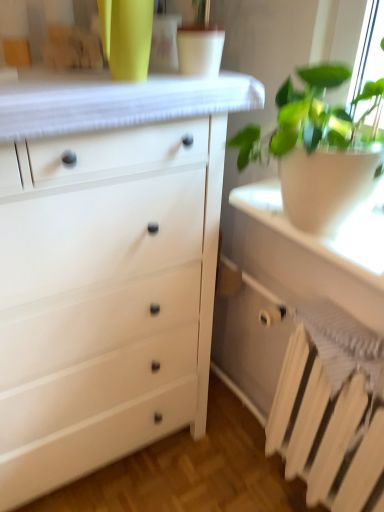
This screenshot has width=384, height=512. What do you see at coordinates (318, 150) in the screenshot?
I see `white matte pot at right` at bounding box center [318, 150].

The height and width of the screenshot is (512, 384). What do you see at coordinates (289, 284) in the screenshot? I see `white matte radiator at lower right` at bounding box center [289, 284].

At what (x,y) coordinates should I click in order to perform the action: click on white textured fabric at upper center. Please return your answer as a coordinate pair (x, y). Looking at the image, I should click on (118, 102).

Is point (260, 364) closer or farther from the camera than point (162, 83)?

Point (260, 364).

How different are the orientations of white matte radiator at lower right and white textured fabric at upper center in degrees?

white matte radiator at lower right and white textured fabric at upper center are facing 88.1 degrees away from each other.

Is white matte radiator at lower right in contact with white textured fabric at upper center?

There is a gap between white matte radiator at lower right and white textured fabric at upper center.

How far apart are white matte radiator at lower right and white textured fabric at upper center?

22.80 inches.

The image size is (384, 512). In order to click on chest of drawers above the white matte radiator at lower right (from a real-world perspective) in this screenshot , I will do `click(107, 270)`.

Is the depth of white matte chest of drawers at left less than that of white matte radiator at lower right?

Yes, white matte chest of drawers at left is closer to the camera.

Can you confirm if white matte chest of drawers at left is thinner than white matte radiator at lower right?

No, white matte chest of drawers at left is not thinner than white matte radiator at lower right.

Considering the points (135, 340) and (225, 314), which point is behind, point (135, 340) or point (225, 314)?

The point (225, 314) is farther.

Where is `counter top lying in front of the white painted metal radiator at lower right`? counter top lying in front of the white painted metal radiator at lower right is located at coordinates (118, 102).

Based on the photo, is white textured fabric at upper center surrounded by white painted metal radiator at lower right?

That's incorrect, white textured fabric at upper center is not inside white painted metal radiator at lower right.

Is white textured fabric at upper center at the back of white painted metal radiator at lower right?

No, white textured fabric at upper center is not at the back of white painted metal radiator at lower right.

Would you say white painted metal radiator at lower right is a long distance from white textured fabric at upper center?

No, white painted metal radiator at lower right is not far from white textured fabric at upper center.

Would you say white matte radiator at lower right is a long distance from white matte chest of drawers at left?

No.

Which object is wider, white matte radiator at lower right or white matte chest of drawers at left?

With larger width is white matte chest of drawers at left.

How much distance is there between white matte radiator at lower right and white matte chest of drawers at left?

white matte radiator at lower right is 41.25 centimeters from white matte chest of drawers at left.

Image resolution: width=384 pixels, height=512 pixels. Find the location of `the chest of drawers that appears above the white matte radiator at lower right (from a real-world perspective)`. the chest of drawers that appears above the white matte radiator at lower right (from a real-world perspective) is located at coordinates [107, 270].

From the image's perspective, which is below, white textured fabric at upper center or white painted metal radiator at lower right?

From the image's view, white painted metal radiator at lower right is below.

From a real-world perspective, which is physically above, white textured fabric at upper center or white painted metal radiator at lower right?

In real-world perspective, white textured fabric at upper center is above.

How different are the orientations of white textured fabric at upper center and white painted metal radiator at lower right in degrees?

88.1 degrees.

Would you say white textured fabric at upper center is to the left or to the right of white painted metal radiator at lower right in the picture?

white textured fabric at upper center is positioned on white painted metal radiator at lower right's left side.

Is white matte chest of drawers at left oriented towards white matte pot at right?

No, white matte chest of drawers at left is not aimed at white matte pot at right.

Can you tell me how much white matte chest of drawers at left and white matte pot at right differ in facing direction?

There is a 85.3-degree angle between the facing directions of white matte chest of drawers at left and white matte pot at right.

Who is taller, white matte chest of drawers at left or white matte pot at right?

With more height is white matte chest of drawers at left.

Which is more to the left, white matte chest of drawers at left or white matte pot at right?

From the viewer's perspective, white matte chest of drawers at left appears more on the left side.

Is white textured fabric at upper center not close to white matte pot at right?

A: No, white textured fabric at upper center is not far away from white matte pot at right.

Is white textured fabric at upper center facing away from white matte pot at right?

No, white matte pot at right is not at the back of white textured fabric at upper center.

Between white textured fabric at upper center and white matte pot at right, which one is positioned in front?

white matte pot at right is in front.

This screenshot has width=384, height=512. In order to click on vanity that appears behind the white textured fabric at upper center in this screenshot , I will do `click(289, 284)`.

This screenshot has width=384, height=512. I want to click on vanity located below the white matte chest of drawers at left (from the image's perspective), so click(289, 284).

Estimate the real-world distances between objects in this image. Which object is further from white matte pot at right, white textured fabric at upper center or white matte radiator at lower right?

white matte radiator at lower right is further to white matte pot at right.

Estimate the real-world distances between objects in this image. Which object is further from white matte chest of drawers at left, white matte radiator at lower right or white textured fabric at upper center?

Based on the image, white matte radiator at lower right appears to be further to white matte chest of drawers at left.

From the image, which object appears to be nearer to white matte chest of drawers at left, white matte radiator at lower right or white painted metal radiator at lower right?

Among the two, white matte radiator at lower right is located nearer to white matte chest of drawers at left.

Based on their spatial positions, is white matte chest of drawers at left or white textured fabric at upper center closer to white painted metal radiator at lower right?

white matte chest of drawers at left is positioned closer to the anchor white painted metal radiator at lower right.

Based on their spatial positions, is white matte pot at right or white textured fabric at upper center closer to white matte chest of drawers at left?

white textured fabric at upper center is positioned closer to the anchor white matte chest of drawers at left.

Looking at the image, which one is located further to white matte chest of drawers at left, white matte radiator at lower right or white matte pot at right?

Based on the image, white matte pot at right appears to be further to white matte chest of drawers at left.

Estimate the real-world distances between objects in this image. Which object is further from white matte pot at right, white matte radiator at lower right or white textured fabric at upper center?

white matte radiator at lower right is further to white matte pot at right.

Considering their positions, is white matte pot at right positioned closer to white painted metal radiator at lower right than white matte chest of drawers at left?

white matte chest of drawers at left lies closer to white painted metal radiator at lower right than the other object.

In order to click on houseplant located between white matte chest of drawers at left and white painted metal radiator at lower right in the left-right direction in this screenshot , I will do `click(318, 150)`.

Where is `houseplant located between white matte chest of drawers at left and white matte radiator at lower right in the left-right direction`? houseplant located between white matte chest of drawers at left and white matte radiator at lower right in the left-right direction is located at coordinates (318, 150).

Locate an element on the screen. This screenshot has height=512, width=384. chest of drawers between white textured fabric at upper center and white matte radiator at lower right in the vertical direction is located at coordinates pyautogui.click(x=107, y=270).

Locate an element on the screen. houseplant that lies between white textured fabric at upper center and white painted metal radiator at lower right from top to bottom is located at coordinates pos(318,150).